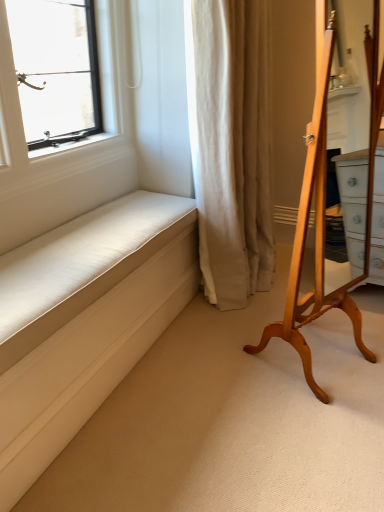
Locate an element on the screen. beige fabric curtain at center is located at coordinates (231, 145).

Measure the distance between point (319, 398) and camera.

Point (319, 398) is 1.63 meters from camera.

The height and width of the screenshot is (512, 384). What do you see at coordinates (84, 320) in the screenshot?
I see `white fabric cushion at lower left` at bounding box center [84, 320].

Identify the location of beige fabric curtain at center. (231, 145).

Is light brown wooden mirror at right at the left side of white fabric cushion at lower left?

No, light brown wooden mirror at right is not to the left of white fabric cushion at lower left.

Which is behind, point (323, 226) or point (70, 233)?

The point (323, 226) is farther from the camera.

Is light brown wooden mirror at right oriented away from white fabric cushion at lower left?

No, light brown wooden mirror at right is not facing the opposite direction of white fabric cushion at lower left.

Is light brown wooden mirror at right with white fabric cushion at lower left?

light brown wooden mirror at right and white fabric cushion at lower left are not in contact.

From the image's perspective, does light brown wooden mirror at right appear higher than beige fabric curtain at center?

No, from the image's perspective, light brown wooden mirror at right is not above beige fabric curtain at center.

Does light brown wooden mirror at right touch beige fabric curtain at center?

No, light brown wooden mirror at right is not with beige fabric curtain at center.

Which is correct: light brown wooden mirror at right is inside beige fabric curtain at center, or outside of it?

light brown wooden mirror at right lies outside beige fabric curtain at center.

Find the location of a particular element. Image resolution: width=384 pixels, height=512 pixels. furniture in front of the beige fabric curtain at center is located at coordinates (324, 219).

Is beige fabric curtain at center positioned with its back to white fabric cushion at lower left?

No, white fabric cushion at lower left is not at the back of beige fabric curtain at center.

Is point (220, 262) positioned behind point (121, 256)?

Yes, point (220, 262) is behind point (121, 256).

From the image's perspective, is beige fabric curtain at center beneath white fabric cushion at lower left?

Incorrect, from the image's perspective, beige fabric curtain at center is higher than white fabric cushion at lower left.

Are beige fabric curtain at center and white fabric cushion at lower left far apart?

No, beige fabric curtain at center is not far away from white fabric cushion at lower left.

The height and width of the screenshot is (512, 384). I want to click on bed frame beneath the light brown wooden mirror at right (from a real-world perspective), so click(84, 320).

Are white fabric cushion at lower left and light brown wooden mirror at right far apart?

That's not correct — white fabric cushion at lower left is a little close to light brown wooden mirror at right.

Could you tell me if white fabric cushion at lower left is turned towards light brown wooden mirror at right?

No, white fabric cushion at lower left is not turned towards light brown wooden mirror at right.

Which point is more distant from viewer, (61, 348) or (298, 353)?

The point (298, 353) is farther.

Is white fabric cushion at lower left inside the boundaries of beige fabric curtain at center, or outside?

white fabric cushion at lower left is not inside beige fabric curtain at center, it's outside.

Between white fabric cushion at lower left and beige fabric curtain at center, which one appears on the left side from the viewer's perspective?

white fabric cushion at lower left.

From a real-world perspective, who is located lower, white fabric cushion at lower left or beige fabric curtain at center?

white fabric cushion at lower left.

What's the angular difference between beige fabric curtain at center and light brown wooden mirror at right's facing directions?

64.4 degrees separate the facing orientations of beige fabric curtain at center and light brown wooden mirror at right.

From the image's perspective, is beige fabric curtain at center located above or below light brown wooden mirror at right?

Based on their image positions, beige fabric curtain at center is located above light brown wooden mirror at right.

From the picture: Does beige fabric curtain at center have a lesser width compared to light brown wooden mirror at right?

No.

Considering the relative positions of beige fabric curtain at center and light brown wooden mirror at right in the image provided, is beige fabric curtain at center to the left of light brown wooden mirror at right from the viewer's perspective?

Yes, beige fabric curtain at center is to the left of light brown wooden mirror at right.

Find the location of `furniture that is above the white fabric cushion at lower left (from a real-world perspective)`. furniture that is above the white fabric cushion at lower left (from a real-world perspective) is located at coordinates (324, 219).

Find the location of `furniture beneath the beige fabric curtain at center (from a real-world perspective)`. furniture beneath the beige fabric curtain at center (from a real-world perspective) is located at coordinates (324, 219).

Based on the photo, which object lies further to the anchor point white fabric cushion at lower left, beige fabric curtain at center or light brown wooden mirror at right?

light brown wooden mirror at right is further to white fabric cushion at lower left.

When comparing their distances from white fabric cushion at lower left, does light brown wooden mirror at right or beige fabric curtain at center seem closer?

beige fabric curtain at center is positioned closer to the anchor white fabric cushion at lower left.

Looking at the image, which one is located closer to light brown wooden mirror at right, white fabric cushion at lower left or beige fabric curtain at center?

The object closer to light brown wooden mirror at right is beige fabric curtain at center.

Consider the image. When comparing their distances from light brown wooden mirror at right, does beige fabric curtain at center or white fabric cushion at lower left seem closer?

beige fabric curtain at center is closer to light brown wooden mirror at right.

Which object lies further to the anchor point beige fabric curtain at center, light brown wooden mirror at right or white fabric cushion at lower left?

white fabric cushion at lower left lies further to beige fabric curtain at center than the other object.

From the image, which object appears to be farther from beige fabric curtain at center, white fabric cushion at lower left or light brown wooden mirror at right?

The object further to beige fabric curtain at center is white fabric cushion at lower left.

Where is `curtain between white fabric cushion at lower left and light brown wooden mirror at right in the horizontal direction`? The width and height of the screenshot is (384, 512). curtain between white fabric cushion at lower left and light brown wooden mirror at right in the horizontal direction is located at coordinates (231, 145).